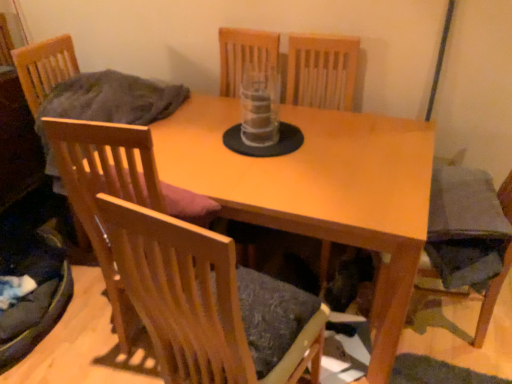
Where is `free space to the left of transparent plastic vase at center`? This screenshot has width=512, height=384. free space to the left of transparent plastic vase at center is located at coordinates (207, 140).